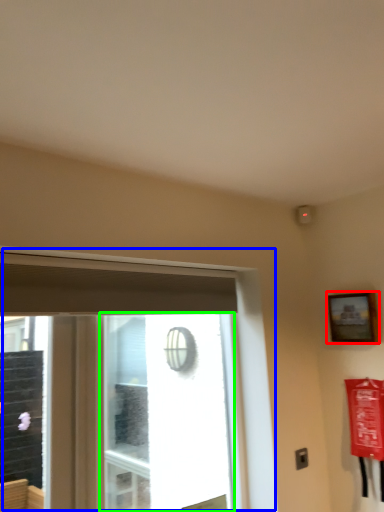
Question: Which object is positioned closest to picture frame (highlighted by a red box)? Select from window (highlighted by a blue box) and window screen (highlighted by a green box).

Choices:
 (A) window
 (B) window screen

Answer: (A)